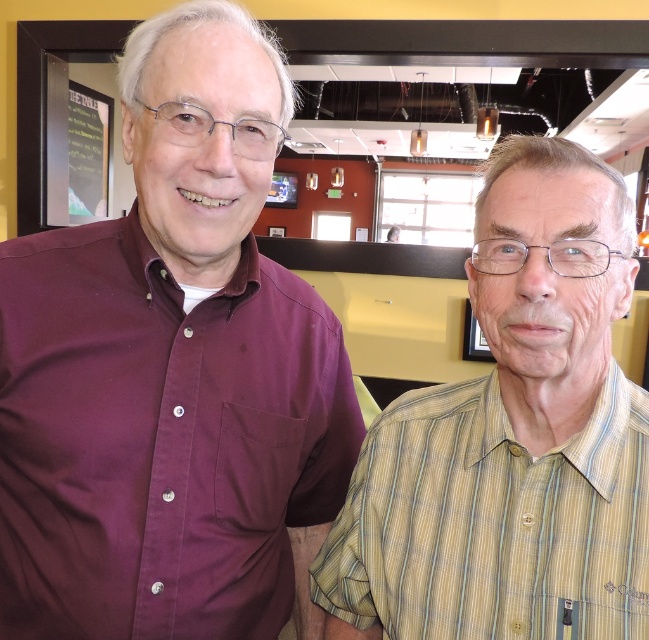
Question: Can you confirm if yellow striped shirt at right is smaller than black chalkboard at upper left?

Choices:
 (A) yes
 (B) no

Answer: (A)

Question: Which of the following is the farthest from the observer?

Choices:
 (A) (43, 33)
 (B) (195, 129)

Answer: (A)

Question: Which of the following is the closest to the observer?

Choices:
 (A) black chalkboard at upper left
 (B) yellow striped shirt at right
 (C) maroon button-up shirt at left
 (D) green chalkboard at upper left

Answer: (B)

Question: Does green chalkboard at upper left have a greater width compared to black chalkboard at upper left?

Choices:
 (A) no
 (B) yes

Answer: (B)

Question: Which of the following is the farthest from the observer?

Choices:
 (A) black chalkboard at upper left
 (B) yellow striped shirt at right
 (C) maroon button-up shirt at left

Answer: (A)

Question: Can you confirm if yellow striped shirt at right is positioned to the right of green chalkboard at upper left?

Choices:
 (A) no
 (B) yes

Answer: (B)